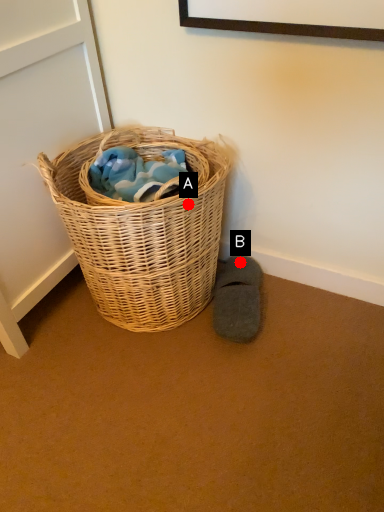
Question: Two points are circled on the image, labeled by A and B beside each circle. Which point is closer to the camera?

Choices:
 (A) A is closer
 (B) B is closer

Answer: (A)